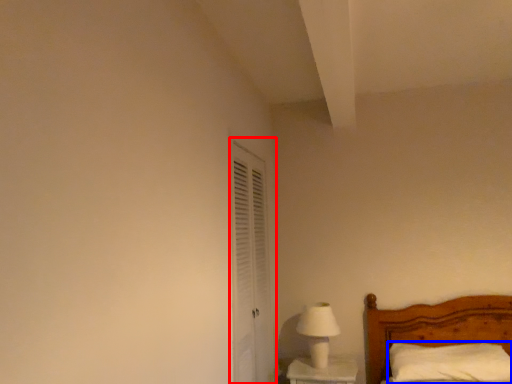
Question: Which point is further to the camera, screen door (highlighted by a red box) or pillow (highlighted by a blue box)?

Choices:
 (A) screen door
 (B) pillow

Answer: (B)